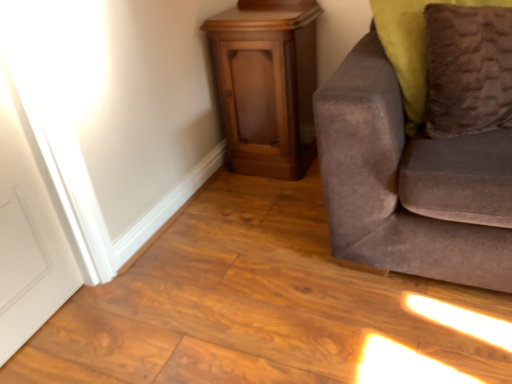
Question: Considering the relative positions of wooden cabinet at center and suede gray couch at right in the image provided, is wooden cabinet at center in front of suede gray couch at right?

Choices:
 (A) no
 (B) yes

Answer: (A)

Question: Is wooden cabinet at center at the right side of suede gray couch at right?

Choices:
 (A) no
 (B) yes

Answer: (A)

Question: Can you confirm if wooden cabinet at center is taller than suede gray couch at right?

Choices:
 (A) no
 (B) yes

Answer: (A)

Question: From the image's perspective, is wooden cabinet at center under suede gray couch at right?

Choices:
 (A) no
 (B) yes

Answer: (A)

Question: Considering the relative sizes of wooden cabinet at center and suede gray couch at right in the image provided, is wooden cabinet at center bigger than suede gray couch at right?

Choices:
 (A) no
 (B) yes

Answer: (A)

Question: From the image's perspective, is wooden cabinet at center positioned above or below brown fuzzy pillow at right?

Choices:
 (A) above
 (B) below

Answer: (A)

Question: Is wooden cabinet at center taller or shorter than brown fuzzy pillow at right?

Choices:
 (A) tall
 (B) short

Answer: (A)

Question: Is wooden cabinet at center in front of or behind brown fuzzy pillow at right in the image?

Choices:
 (A) front
 (B) behind

Answer: (B)

Question: Is wooden cabinet at center to the left or to the right of brown fuzzy pillow at right in the image?

Choices:
 (A) right
 (B) left

Answer: (B)

Question: From a real-world perspective, is suede gray couch at right physically located above or below brown fuzzy pillow at right?

Choices:
 (A) above
 (B) below

Answer: (B)

Question: Does point (380, 77) appear closer or farther from the camera than point (436, 107)?

Choices:
 (A) closer
 (B) farther

Answer: (A)

Question: Is suede gray couch at right in front of or behind brown fuzzy pillow at right in the image?

Choices:
 (A) front
 (B) behind

Answer: (A)

Question: Looking at their shapes, would you say suede gray couch at right is wider or thinner than brown fuzzy pillow at right?

Choices:
 (A) thin
 (B) wide

Answer: (B)

Question: Is brown fuzzy pillow at right to the left or to the right of wooden cabinet at center in the image?

Choices:
 (A) right
 (B) left

Answer: (A)

Question: Considering the positions of point (459, 117) and point (272, 92), is point (459, 117) closer or farther from the camera than point (272, 92)?

Choices:
 (A) farther
 (B) closer

Answer: (B)